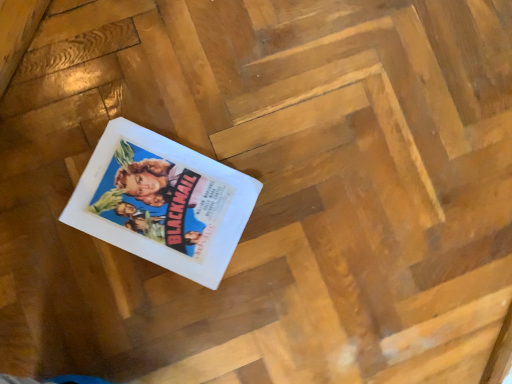
Locate an element on the screen. free point behind white paper at center is located at coordinates (245, 120).